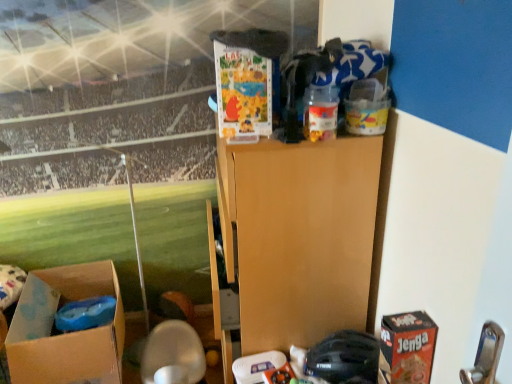
Question: Are translucent plastic container at upper center, acting as the 2th toy starting from the bottom, and red cardboard jenga box at lower right located far from each other?

Choices:
 (A) no
 (B) yes

Answer: (A)

Question: From the image's perspective, is translucent plastic container at upper center, acting as the 2th toy starting from the bottom, on top of red cardboard jenga box at lower right?

Choices:
 (A) no
 (B) yes

Answer: (B)

Question: Can we say translucent plastic container at upper center, which ranks as the 1th toy in front-to-back order, lies outside red cardboard jenga box at lower right?

Choices:
 (A) no
 (B) yes

Answer: (B)

Question: Considering the relative sizes of translucent plastic container at upper center, acting as the 2th toy starting from the bottom, and red cardboard jenga box at lower right in the image provided, is translucent plastic container at upper center, acting as the 2th toy starting from the bottom, taller than red cardboard jenga box at lower right?

Choices:
 (A) yes
 (B) no

Answer: (B)

Question: Can you confirm if translucent plastic container at upper center, which ranks as the 1th toy in front-to-back order, is thinner than red cardboard jenga box at lower right?

Choices:
 (A) yes
 (B) no

Answer: (A)

Question: Does point click(426, 370) appear closer or farther from the camera than point click(361, 342)?

Choices:
 (A) closer
 (B) farther

Answer: (A)

Question: In terms of height, does red cardboard jenga box at lower right look taller or shorter compared to black matte helmet at lower center, the first toy positioned from the bottom?

Choices:
 (A) short
 (B) tall

Answer: (B)

Question: From the image's perspective, is red cardboard jenga box at lower right above or below black matte helmet at lower center, the 2th toy when ordered from front to back?

Choices:
 (A) above
 (B) below

Answer: (A)

Question: From a real-world perspective, is red cardboard jenga box at lower right above or below black matte helmet at lower center, arranged as the first toy when viewed from the back?

Choices:
 (A) above
 (B) below

Answer: (A)

Question: Is translucent plastic container at upper center, which ranks as the 1th toy in front-to-back order, in front of or behind red cardboard jenga box at lower right in the image?

Choices:
 (A) front
 (B) behind

Answer: (B)

Question: Considering the positions of point (332, 102) and point (425, 370), is point (332, 102) closer or farther from the camera than point (425, 370)?

Choices:
 (A) farther
 (B) closer

Answer: (A)

Question: From a real-world perspective, is translucent plastic container at upper center, which ranks as the 1th toy in front-to-back order, positioned above or below red cardboard jenga box at lower right?

Choices:
 (A) above
 (B) below

Answer: (A)

Question: Is translucent plastic container at upper center, acting as the 2th toy starting from the bottom, inside or outside of red cardboard jenga box at lower right?

Choices:
 (A) inside
 (B) outside

Answer: (B)

Question: Visually, is matte cardboard box at upper center, positioned as the second box in left-to-right order, positioned to the left or to the right of translucent plastic container at upper center, which ranks as the 1th toy in front-to-back order?

Choices:
 (A) right
 (B) left

Answer: (B)

Question: From the image's perspective, relative to translucent plastic container at upper center, arranged as the 2th toy when viewed from the back, is matte cardboard box at upper center, marked as the first box in a top-to-bottom arrangement, above or below?

Choices:
 (A) above
 (B) below

Answer: (A)